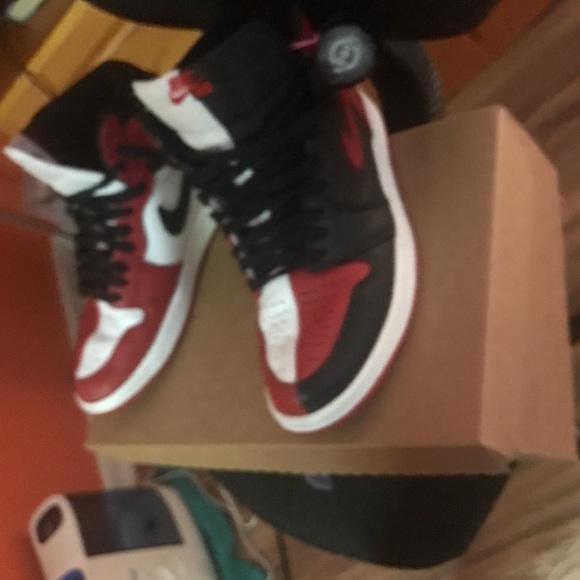
Where is `box`? The image size is (580, 580). box is located at coordinates (560, 328).